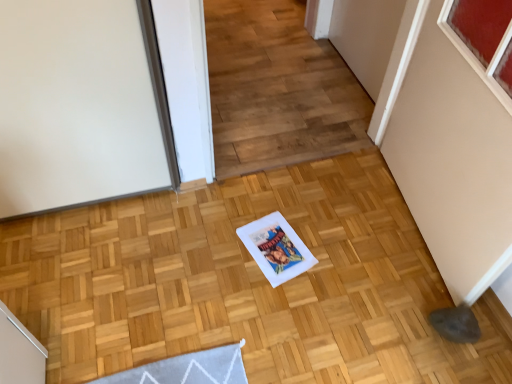
Where is `free spot to the right of white glossy postcard at center`? free spot to the right of white glossy postcard at center is located at coordinates (331, 252).